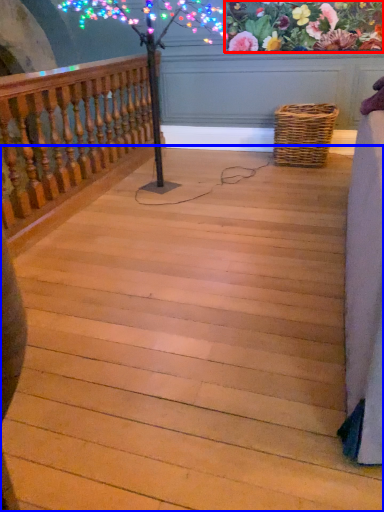
Question: Which object appears closest to the camera in this image, floral arrangement (highlighted by a red box) or stairs (highlighted by a blue box)?

Choices:
 (A) floral arrangement
 (B) stairs

Answer: (B)